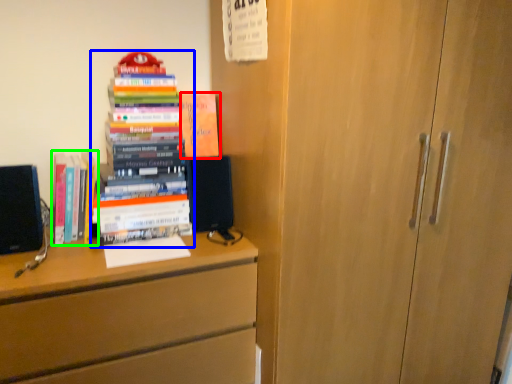
Question: Which is farther away from book (highlighted by a red box)? book (highlighted by a blue box) or book (highlighted by a green box)?

Choices:
 (A) book
 (B) book

Answer: (B)